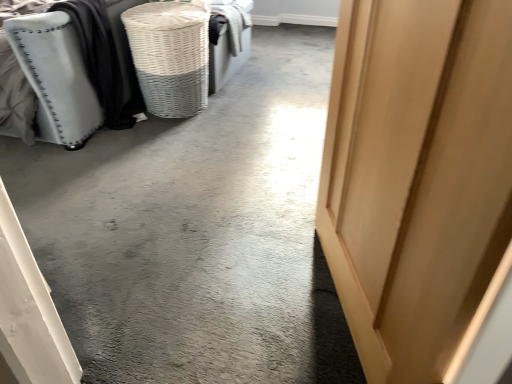
Question: From a real-world perspective, is light wood door at center right physically located above or below white wicker basket at upper left?

Choices:
 (A) below
 (B) above

Answer: (B)

Question: Based on their sizes in the image, would you say light wood door at center right is bigger or smaller than white wicker basket at upper left?

Choices:
 (A) small
 (B) big

Answer: (B)

Question: Which is farther from the white wicker basket at upper left?

Choices:
 (A) matte gray fabric ottoman at left
 (B) light wood door at center right

Answer: (B)

Question: Estimate the real-world distances between objects in this image. Which object is farther from the light wood door at center right?

Choices:
 (A) white wicker basket at upper left
 (B) matte gray fabric ottoman at left

Answer: (B)